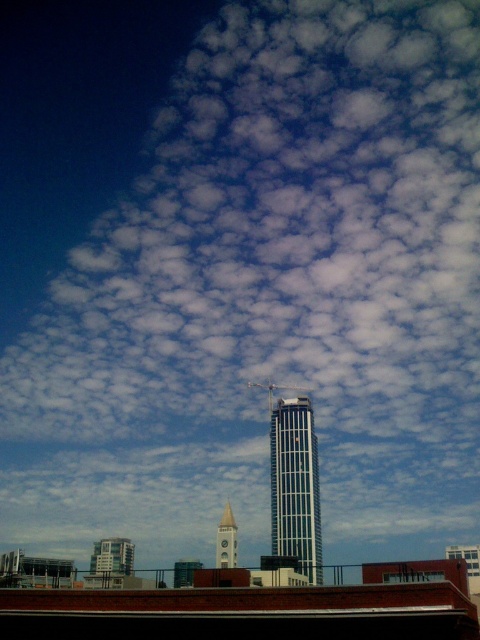
Between silver metallic bell tower at center and light gray stone bell tower at center, which one appears on the left side from the viewer's perspective?

light gray stone bell tower at center

Is silver metallic bell tower at center above light gray stone bell tower at center?

Yes, silver metallic bell tower at center is above light gray stone bell tower at center.

Is point (312, 420) farther from viewer compared to point (231, 515)?

Yes, point (312, 420) is behind point (231, 515).

Locate an element on the screen. The height and width of the screenshot is (640, 480). silver metallic bell tower at center is located at coordinates pos(296,486).